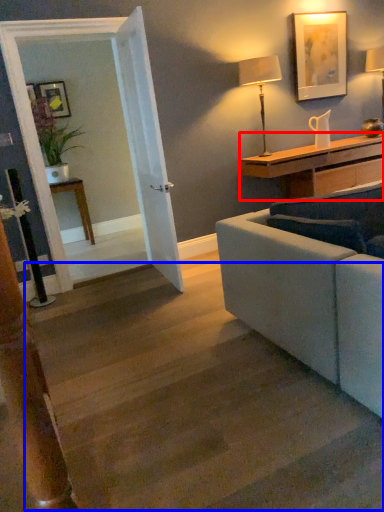
Question: Which object appears closest to the camera in this image, desk (highlighted by a red box) or stairwell (highlighted by a blue box)?

Choices:
 (A) desk
 (B) stairwell

Answer: (B)